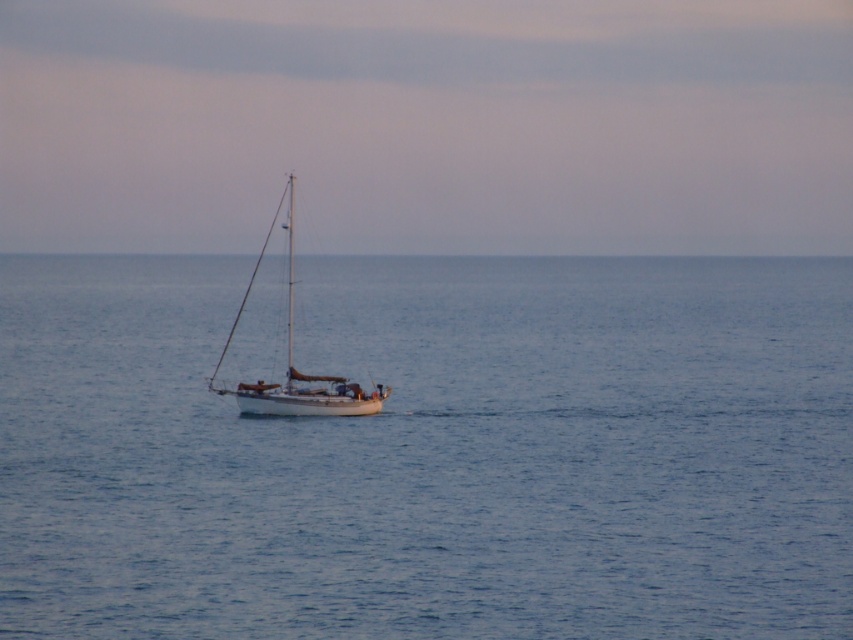
From the picture: Who is shorter, blue water at center or white matte sailboat at center?

→ blue water at center is shorter.

Is blue water at center shorter than white matte sailboat at center?

Yes, blue water at center is shorter than white matte sailboat at center.

Does point (558, 440) come closer to viewer compared to point (321, 406)?

Yes, point (558, 440) is closer to viewer.

The width and height of the screenshot is (853, 640). I want to click on blue water at center, so click(431, 451).